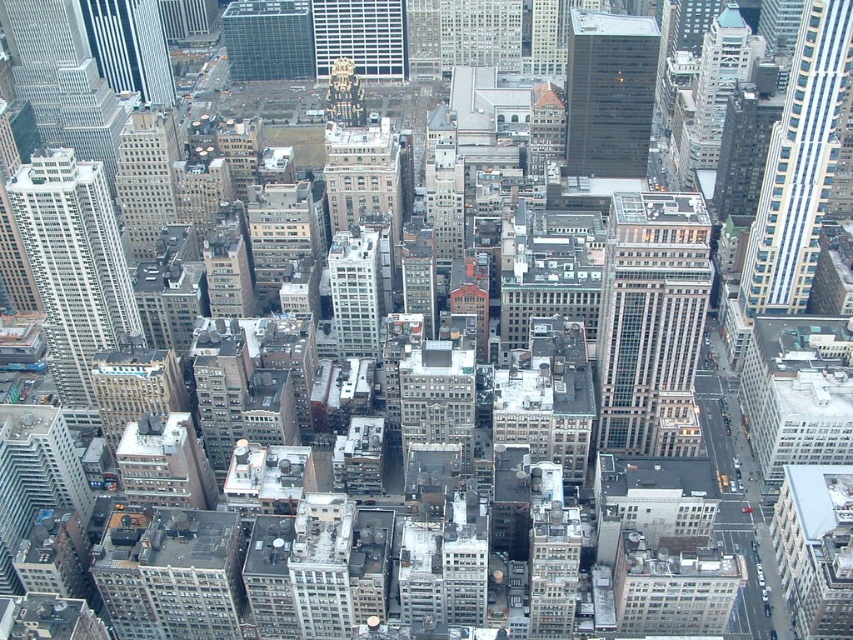
Can you confirm if dark glass skyscraper at center is smaller than white glass skyscraper at center?

No.

Which is more to the right, dark glass skyscraper at center or white glass skyscraper at center?

A: From the viewer's perspective, dark glass skyscraper at center appears more on the right side.

Who is more distant from viewer, (579, 147) or (341, 45)?

The point (341, 45) is more distant.

Locate an element on the screen. The image size is (853, 640). dark glass skyscraper at center is located at coordinates (608, 92).

Is point (610, 60) positioned after point (282, 77)?

Yes, point (610, 60) is behind point (282, 77).

Is point (614, 144) positioned before point (309, 72)?

Yes, point (614, 144) is closer to viewer.

Where is `dark glass skyscraper at center`? Image resolution: width=853 pixels, height=640 pixels. dark glass skyscraper at center is located at coordinates (608, 92).

Can you confirm if clear glass skyscraper at upper center is positioned to the right of white smooth building at center?

No, clear glass skyscraper at upper center is not to the right of white smooth building at center.

Who is positioned more to the right, clear glass skyscraper at upper center or white smooth building at center?

white smooth building at center is more to the right.

The height and width of the screenshot is (640, 853). Describe the element at coordinates (268, 38) in the screenshot. I see `clear glass skyscraper at upper center` at that location.

Where is `clear glass skyscraper at upper center`? clear glass skyscraper at upper center is located at coordinates (268, 38).